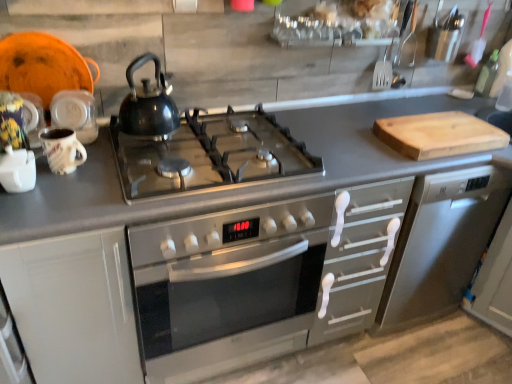
What are the coordinates of `white matte coffee cup at left, the second appliance when ordered from back to front` in the screenshot? It's located at (17, 170).

How much space does white matte coffee cup at left, the second appliance when ordered from back to front, occupy vertically?

white matte coffee cup at left, the second appliance when ordered from back to front, is 4.77 inches tall.

What do you see at coordinates (441, 244) in the screenshot? I see `metallic stainless steel dishwasher at right` at bounding box center [441, 244].

Measure the distance between point (78, 98) and camera.

They are 4.23 feet apart.

Locate an element on the screen. white matte cabinet at left is located at coordinates (74, 307).

Where is `white matte coffee cup at left, which is the 2th appliance from top to bottom`? The width and height of the screenshot is (512, 384). white matte coffee cup at left, which is the 2th appliance from top to bottom is located at coordinates (17, 170).

In terms of size, does stainless steel oven at center appear bigger or smaller than glossy black kettle at center?

stainless steel oven at center is bigger than glossy black kettle at center.

Considering the sizes of stainless steel oven at center and glossy black kettle at center in the image, is stainless steel oven at center taller or shorter than glossy black kettle at center?

In the image, stainless steel oven at center appears to be taller than glossy black kettle at center.

Is stainless steel oven at center positioned before glossy black kettle at center?

Yes, stainless steel oven at center is closer to the viewer.

Which object is positioned more to the left, stainless steel oven at center or glossy black kettle at center?

glossy black kettle at center.

Can you confirm if white matte cabinet at left is positioned to the left of matte ceramic mug at left?

Yes.

Which of these two, white matte cabinet at left or matte ceramic mug at left, stands taller?

Standing taller between the two is white matte cabinet at left.

Considering the points (31, 335) and (74, 161), which point is behind, point (31, 335) or point (74, 161)?

Point (74, 161)

This screenshot has height=384, width=512. Identify the location of cabinetry below the matte ceramic mug at left (from a real-world perspective). (74, 307).

Measure the distance between stainless steel oven at center and matte ceramic mug at upper left, the 2th appliance positioned from the front.

stainless steel oven at center is 25.27 inches away from matte ceramic mug at upper left, the 2th appliance positioned from the front.

Is stainless steel oven at center situated inside matte ceramic mug at upper left, the second appliance in the bottom-to-top sequence, or outside?

stainless steel oven at center is located beyond the bounds of matte ceramic mug at upper left, the second appliance in the bottom-to-top sequence.

Which object is closer to the camera taking this photo, stainless steel oven at center or matte ceramic mug at upper left, the 2th appliance positioned from the front?

stainless steel oven at center is more forward.

From the image's perspective, relative to matte ceramic mug at upper left, which ranks as the 1th appliance in back-to-front order, is stainless steel oven at center above or below?

Based on their image positions, stainless steel oven at center is located beneath matte ceramic mug at upper left, which ranks as the 1th appliance in back-to-front order.

Is metallic stainless steel dishwasher at right spatially inside white matte coffee cup at left, which is the 2th appliance from top to bottom, or outside of it?

metallic stainless steel dishwasher at right is spatially situated outside white matte coffee cup at left, which is the 2th appliance from top to bottom.

Does point (500, 194) come farther from viewer compared to point (5, 188)?

Yes.

Does metallic stainless steel dishwasher at right have a greater width compared to white matte coffee cup at left, which is the 2th appliance from top to bottom?

Correct, the width of metallic stainless steel dishwasher at right exceeds that of white matte coffee cup at left, which is the 2th appliance from top to bottom.

Where is `dish washer on the right side of white matte coffee cup at left, which is the 2th appliance from top to bottom`? This screenshot has width=512, height=384. dish washer on the right side of white matte coffee cup at left, which is the 2th appliance from top to bottom is located at coordinates (441, 244).

Is glossy black kettle at center outside of matte ceramic mug at upper left, which appears as the first appliance when viewed from the top?

Indeed, glossy black kettle at center is completely outside matte ceramic mug at upper left, which appears as the first appliance when viewed from the top.

Is glossy black kettle at center bigger or smaller than matte ceramic mug at upper left, the 2th appliance positioned from the front?

Considering their sizes, glossy black kettle at center takes up more space than matte ceramic mug at upper left, the 2th appliance positioned from the front.

Based on the photo, considering the sizes of glossy black kettle at center and matte ceramic mug at upper left, which appears as the first appliance when viewed from the top, in the image, is glossy black kettle at center taller or shorter than matte ceramic mug at upper left, which appears as the first appliance when viewed from the top,?

Clearly, glossy black kettle at center is taller compared to matte ceramic mug at upper left, which appears as the first appliance when viewed from the top.

Is glossy black kettle at center further to the viewer compared to matte ceramic mug at upper left, the 2th appliance positioned from the front?

No, it is in front of matte ceramic mug at upper left, the 2th appliance positioned from the front.

Is stainless steel oven at center at the left side of matte ceramic mug at left?

No.

From the image's perspective, which is above, stainless steel oven at center or matte ceramic mug at left?

matte ceramic mug at left.

Is point (188, 347) closer or farther from the camera than point (53, 156)?

Clearly, point (188, 347) is more distant from the camera than point (53, 156).

Is glossy black kettle at center positioned in front of wooden cutting board at right?

Yes, glossy black kettle at center is closer to the viewer.

Is wooden cutting board at right at the back of glossy black kettle at center?

glossy black kettle at center does not have its back to wooden cutting board at right.

Would you say wooden cutting board at right is part of glossy black kettle at center's contents?

No, wooden cutting board at right is not a part of glossy black kettle at center.

How much distance is there between glossy black kettle at center and wooden cutting board at right?

glossy black kettle at center and wooden cutting board at right are 87.54 centimeters apart.

Find the location of a particular element. kettle lying behind the stainless steel oven at center is located at coordinates (148, 104).

Image resolution: width=512 pixels, height=384 pixels. What are the coordinates of `cabinetry that is on the left side of matte ceramic mug at left` in the screenshot? It's located at (74, 307).

From the image, which object appears to be farther from stainless steel oven at center, glossy black kettle at center or wooden cutting board at right?

wooden cutting board at right is positioned further to the anchor stainless steel oven at center.

Which object lies nearer to the anchor point matte ceramic mug at upper left, which ranks as the 1th appliance in back-to-front order, wooden cutting board at right or metallic stainless steel dishwasher at right?

wooden cutting board at right is closer to matte ceramic mug at upper left, which ranks as the 1th appliance in back-to-front order.

Looking at this image, which object lies further to the anchor point white matte coffee cup at left, the 1th appliance when ordered from bottom to top, glossy black kettle at center or stainless steel oven at center?

Based on the image, stainless steel oven at center appears to be further to white matte coffee cup at left, the 1th appliance when ordered from bottom to top.

Looking at the image, which one is located closer to green glass bottle at upper right, stainless steel oven at center or white matte coffee cup at left, which is the 2th appliance from top to bottom?

stainless steel oven at center.

Estimate the real-world distances between objects in this image. Which object is further from white matte cabinet at left, matte ceramic mug at upper left, which ranks as the 1th appliance in back-to-front order, or green glass bottle at upper right?

Among the two, green glass bottle at upper right is located further to white matte cabinet at left.

When comparing their distances from white matte coffee cup at left, the second appliance when ordered from back to front, does white matte cabinet at left or wooden cutting board at right seem further?

The object further to white matte coffee cup at left, the second appliance when ordered from back to front, is wooden cutting board at right.

Which object lies further to the anchor point wooden cutting board at right, matte ceramic mug at left or white matte coffee cup at left, the second appliance when ordered from back to front?

Among the two, white matte coffee cup at left, the second appliance when ordered from back to front, is located further to wooden cutting board at right.

Which object lies nearer to the anchor point stainless steel oven at center, white matte cabinet at left or glossy black kettle at center?

The object closer to stainless steel oven at center is white matte cabinet at left.

Where is `oven located between matte ceramic mug at upper left, the second appliance in the bottom-to-top sequence, and metallic stainless steel dishwasher at right in the left-right direction`? oven located between matte ceramic mug at upper left, the second appliance in the bottom-to-top sequence, and metallic stainless steel dishwasher at right in the left-right direction is located at coordinates (227, 287).

Identify the location of cabinetry between white matte coffee cup at left, which ranks as the 1th appliance in front-to-back order, and wooden cutting board at right from left to right. (74, 307).

Where is `oven between white matte cabinet at left and wooden cutting board at right`? The width and height of the screenshot is (512, 384). oven between white matte cabinet at left and wooden cutting board at right is located at coordinates (227, 287).

Locate an element on the screen. The width and height of the screenshot is (512, 384). appliance between white matte coffee cup at left, the 1th appliance when ordered from bottom to top, and wooden cutting board at right from left to right is located at coordinates (75, 114).